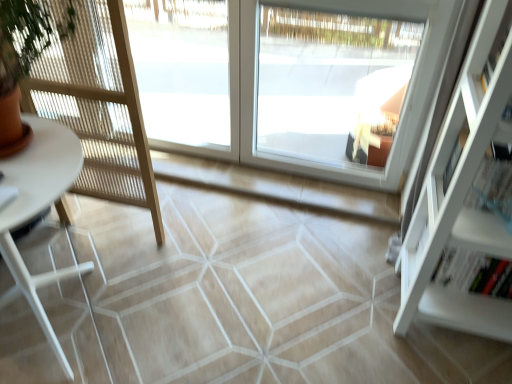
Question: Is white glossy table at left positioned in front of white glass window at center, positioned as the second window in left-to-right order?

Choices:
 (A) yes
 (B) no

Answer: (A)

Question: Is white glass window at center, placed as the 2th window when sorted from right to left, inside white glossy table at left?

Choices:
 (A) no
 (B) yes

Answer: (A)

Question: Is white glossy table at left at the right side of white glass window at center, placed as the 2th window when sorted from right to left?

Choices:
 (A) no
 (B) yes

Answer: (A)

Question: Does white glossy table at left have a smaller size compared to white glass window at center, placed as the 2th window when sorted from right to left?

Choices:
 (A) no
 (B) yes

Answer: (A)

Question: From the image's perspective, is white glossy table at left beneath white glass window at center, placed as the 2th window when sorted from right to left?

Choices:
 (A) yes
 (B) no

Answer: (A)

Question: Is white glossy table at left turned away from white glass window at center, positioned as the second window in left-to-right order?

Choices:
 (A) no
 (B) yes

Answer: (B)

Question: Is white matte shelf at right further to the viewer compared to white glossy table at left?

Choices:
 (A) no
 (B) yes

Answer: (A)

Question: Considering the relative sizes of white matte shelf at right and white glossy table at left in the image provided, is white matte shelf at right shorter than white glossy table at left?

Choices:
 (A) no
 (B) yes

Answer: (A)

Question: Is white matte shelf at right closer to the viewer compared to white glossy table at left?

Choices:
 (A) yes
 (B) no

Answer: (A)

Question: From a real-world perspective, is white matte shelf at right below white glossy table at left?

Choices:
 (A) no
 (B) yes

Answer: (A)

Question: Does white matte shelf at right appear on the left side of white glossy table at left?

Choices:
 (A) no
 (B) yes

Answer: (A)

Question: Is white matte shelf at right taller than white glossy table at left?

Choices:
 (A) yes
 (B) no

Answer: (A)

Question: Does white glossy table at left have a greater height compared to transparent glass window at center, which appears as the 3th window when viewed from the right?

Choices:
 (A) yes
 (B) no

Answer: (B)